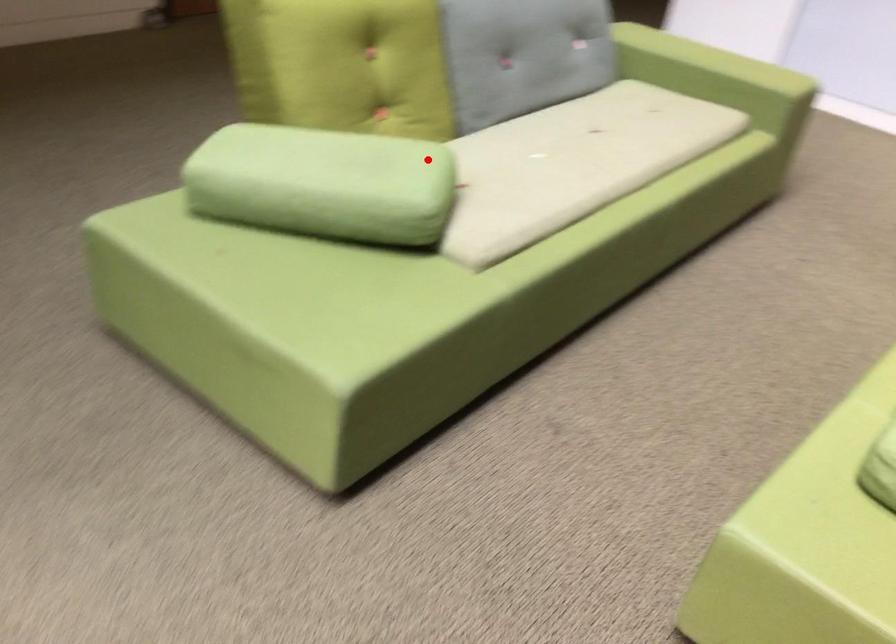
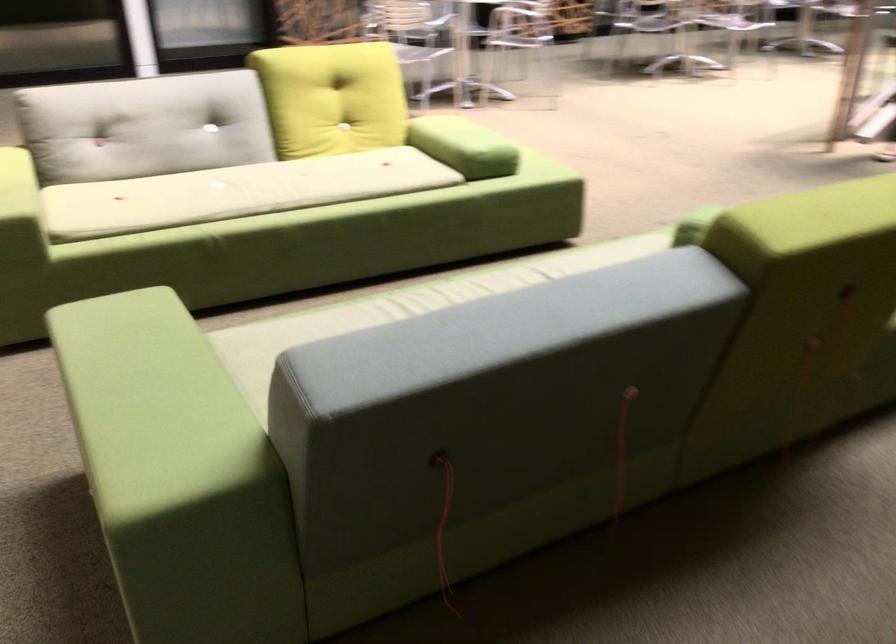
In the second image, find the point that corresponds to the highlighted location in the first image.

(694, 225)